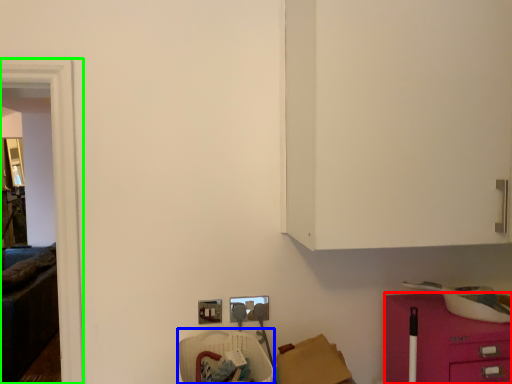
Question: Considering the real-world distances, which object is farthest from furniture (highlighted by a red box)? armchair (highlighted by a blue box) or glass door (highlighted by a green box)?

Choices:
 (A) armchair
 (B) glass door

Answer: (B)